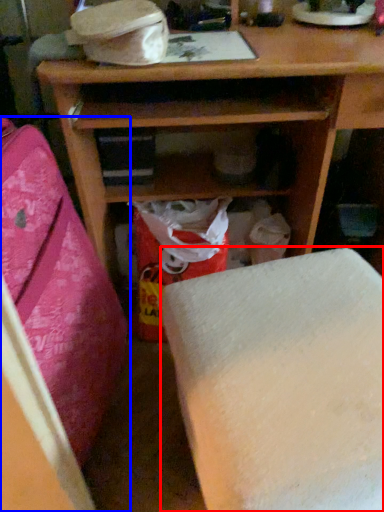
Question: Which of the following is the farthest to the observer, furniture (highlighted by a red box) or furniture (highlighted by a blue box)?

Choices:
 (A) furniture
 (B) furniture

Answer: (A)